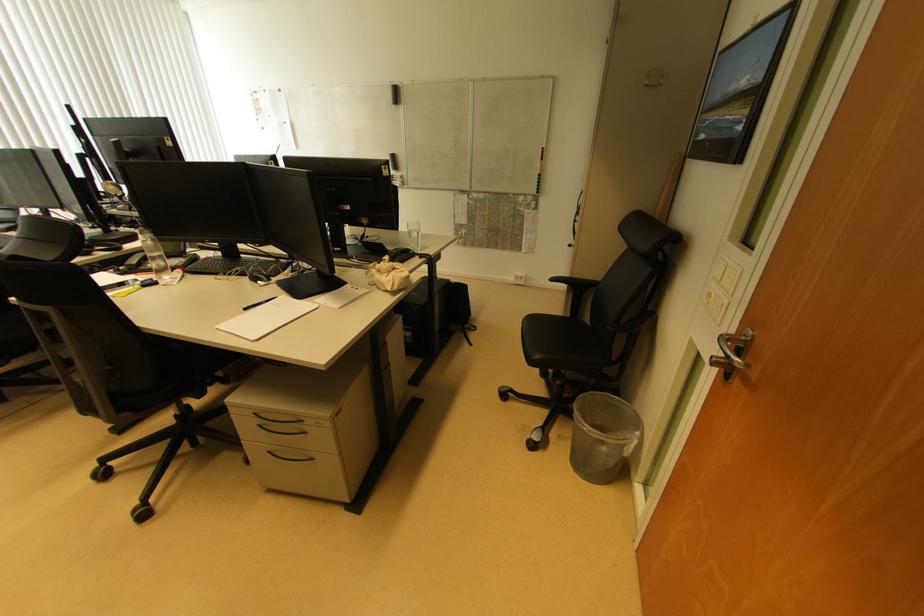
What do you see at coordinates (576, 283) in the screenshot? The height and width of the screenshot is (616, 924). I see `a black chair armrest` at bounding box center [576, 283].